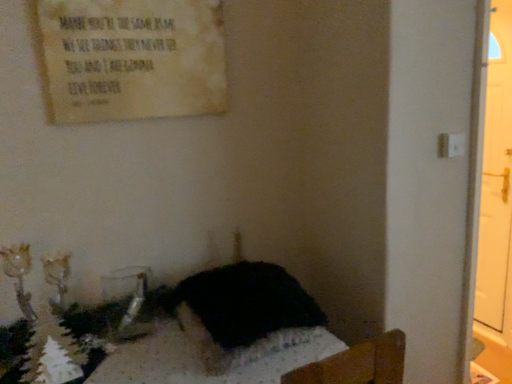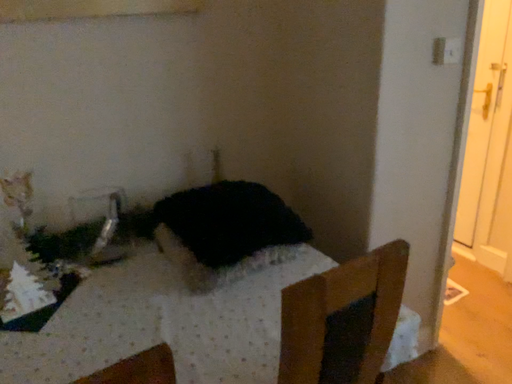
Question: Which way did the camera rotate in the video?

Choices:
 (A) rotated downward
 (B) rotated upward

Answer: (A)